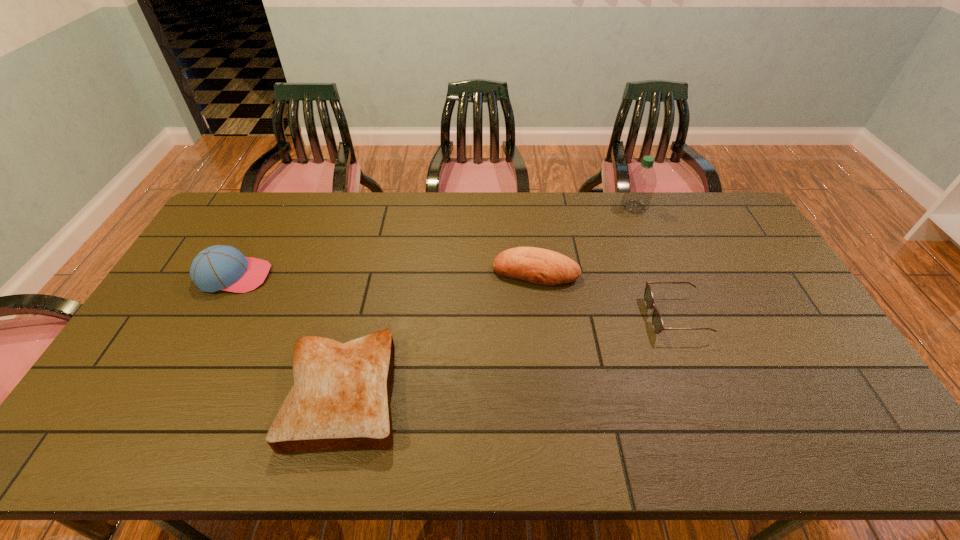
The width and height of the screenshot is (960, 540). In the image, there is a desktop. Identify the location of free space at the near edge. (209, 456).

Where is `free space at the left edge of the desktop`? free space at the left edge of the desktop is located at coordinates (176, 289).

In the image, there is a desktop. At what (x,y) coordinates should I click in order to perform the action: click on vacant space at the right edge. Please return your answer as a coordinate pair (x, y). Looking at the image, I should click on (796, 374).

In the image, there is a desktop. What are the coordinates of `vacant space at the far left corner` in the screenshot? It's located at [x=237, y=198].

At what (x,y) coordinates should I click in order to perform the action: click on free space at the far right corner of the desktop. Please return your answer as a coordinate pair (x, y). The height and width of the screenshot is (540, 960). Looking at the image, I should click on point(724,195).

Where is `free point between the nearer bread and the right bread`? Image resolution: width=960 pixels, height=540 pixels. free point between the nearer bread and the right bread is located at coordinates (440, 332).

This screenshot has width=960, height=540. In order to click on free space between the water bottle and the nearer bread in this screenshot , I will do `click(490, 300)`.

What are the coordinates of `unoccupied area between the water bottle and the spectacles` in the screenshot? It's located at (655, 262).

Locate an element on the screen. This screenshot has height=540, width=960. vacant space that's between the third object from left to right and the tallest object is located at coordinates pyautogui.click(x=585, y=239).

Where is `unoccupied area between the water bottle and the left bread`? Image resolution: width=960 pixels, height=540 pixels. unoccupied area between the water bottle and the left bread is located at coordinates (490, 300).